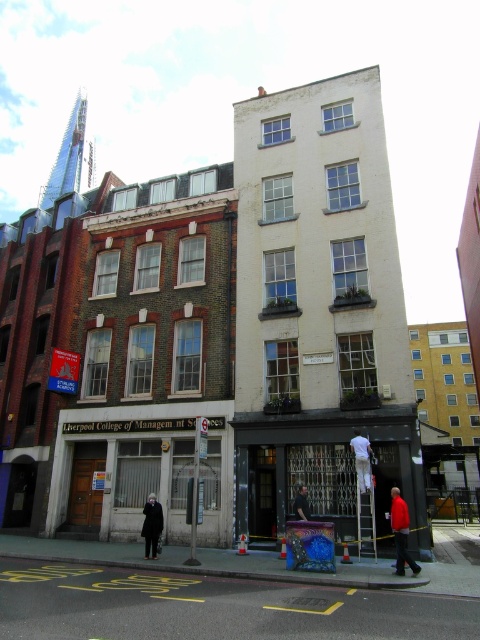
You are standing at the center of the street looking towards the buildings. There is a red cotton shirt at lower right. Can you see the red cotton shirt from your current position?

Yes, the red cotton shirt at lower right is located at point (400, 532) which is within your field of view from the center of the street.

You are standing at the center of the street looking towards the buildings. There is a red cotton shirt at lower right. Where exactly is the red cotton shirt located in terms of coordinates?

The red cotton shirt at lower right is located at coordinates point (400, 532).

You are standing on the street looking at the buildings. You see a red cotton shirt at lower right and a black wool coat at center. Which clothing item is positioned more to the right?

The red cotton shirt at lower right is positioned more to the right than the black wool coat at center according to the description.